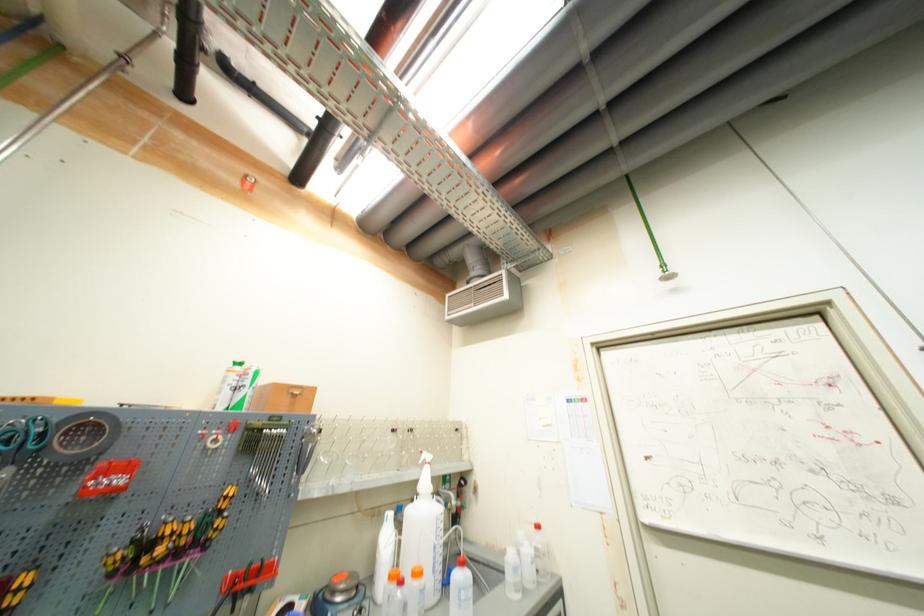
The height and width of the screenshot is (616, 924). What are the coordinates of `orange topped knob` in the screenshot? It's located at (248, 182).